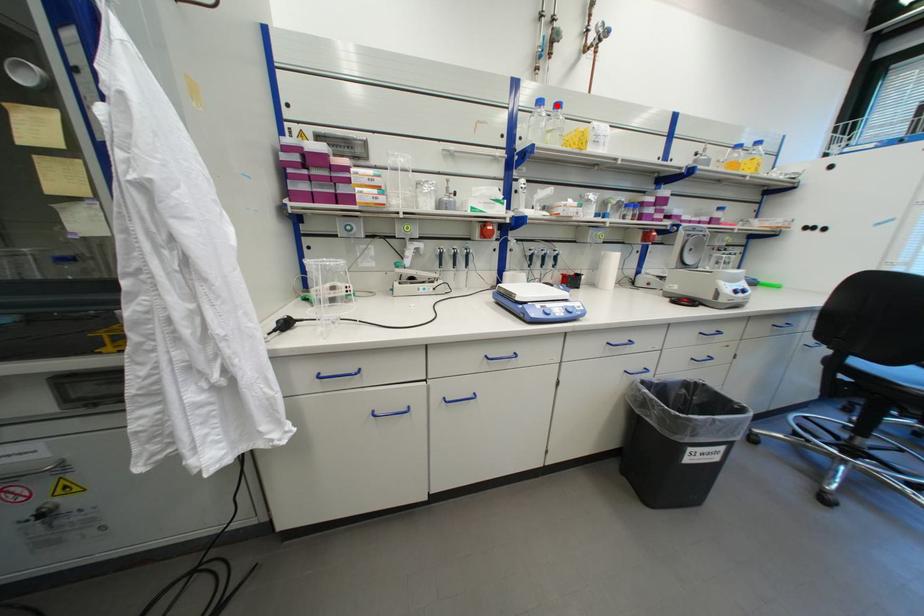
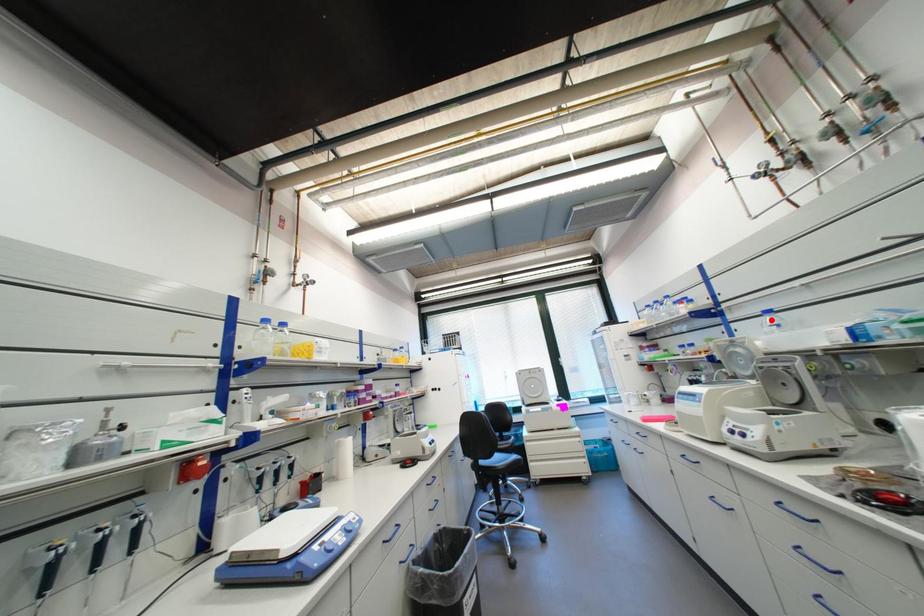
I am providing you with two images of the same scene from different viewpoints. A red point is marked on the first image and another point is marked on the second image. Are the points marked in image1 and image2 representing the same 3D position?

No